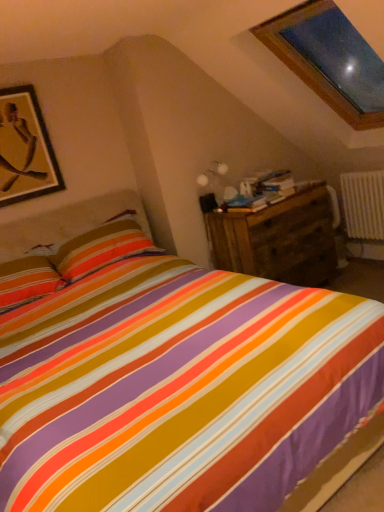
Question: Is gold matte picture frame at upper left surrounded by wooden chest of drawers at right?

Choices:
 (A) no
 (B) yes

Answer: (A)

Question: Are wooden chest of drawers at right and gold matte picture frame at upper left making contact?

Choices:
 (A) yes
 (B) no

Answer: (B)

Question: Does wooden chest of drawers at right have a lesser height compared to gold matte picture frame at upper left?

Choices:
 (A) no
 (B) yes

Answer: (A)

Question: Can you confirm if wooden chest of drawers at right is thinner than gold matte picture frame at upper left?

Choices:
 (A) yes
 (B) no

Answer: (B)

Question: Can you confirm if wooden chest of drawers at right is taller than gold matte picture frame at upper left?

Choices:
 (A) yes
 (B) no

Answer: (A)

Question: From the image's perspective, relative to white plastic radiator at right, is gold matte picture frame at upper left above or below?

Choices:
 (A) above
 (B) below

Answer: (A)

Question: Is gold matte picture frame at upper left spatially inside white plastic radiator at right, or outside of it?

Choices:
 (A) inside
 (B) outside

Answer: (B)

Question: From a real-world perspective, relative to white plastic radiator at right, is gold matte picture frame at upper left vertically above or below?

Choices:
 (A) above
 (B) below

Answer: (A)

Question: In the image, is gold matte picture frame at upper left positioned in front of or behind white plastic radiator at right?

Choices:
 (A) front
 (B) behind

Answer: (A)

Question: From the image's perspective, is wooden chest of drawers at right positioned above or below white plastic radiator at right?

Choices:
 (A) below
 (B) above

Answer: (A)

Question: Considering their positions, is wooden chest of drawers at right located in front of or behind white plastic radiator at right?

Choices:
 (A) behind
 (B) front

Answer: (B)

Question: In terms of size, does wooden chest of drawers at right appear bigger or smaller than white plastic radiator at right?

Choices:
 (A) small
 (B) big

Answer: (B)

Question: Is wooden chest of drawers at right to the left or to the right of white plastic radiator at right in the image?

Choices:
 (A) right
 (B) left

Answer: (B)

Question: Choose the correct answer: Is wooden chest of drawers at right inside gold matte picture frame at upper left or outside it?

Choices:
 (A) outside
 (B) inside

Answer: (A)

Question: From the image's perspective, is wooden chest of drawers at right located above or below gold matte picture frame at upper left?

Choices:
 (A) above
 (B) below

Answer: (B)